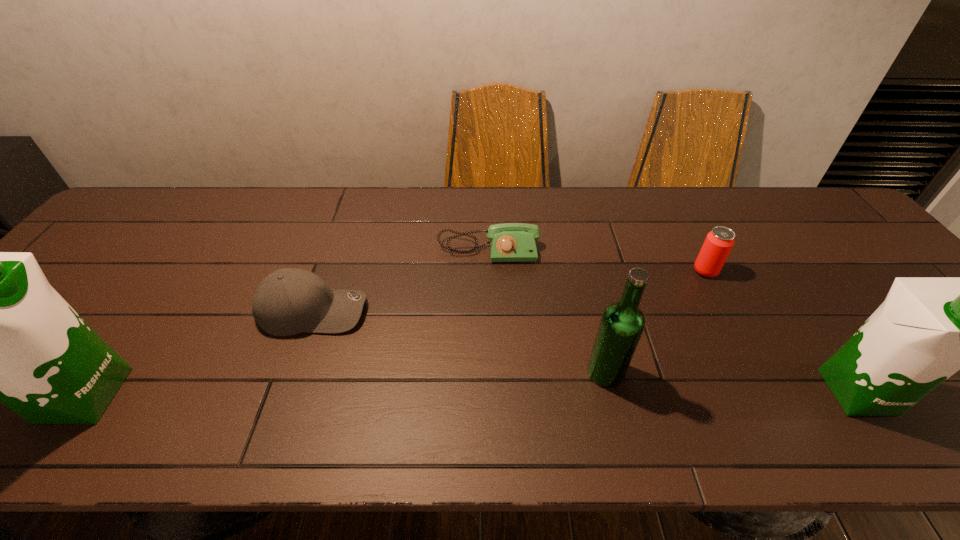
Find the location of `unoccupied area between the taller soya milk and the second object from right to left`. unoccupied area between the taller soya milk and the second object from right to left is located at coordinates (395, 333).

Find the location of `free point between the beer bottle and the right soya milk`. free point between the beer bottle and the right soya milk is located at coordinates (732, 382).

Where is `free space between the telephone and the beer bottle`? free space between the telephone and the beer bottle is located at coordinates (547, 311).

Where is `empty space that is in between the telephone and the fourth nearest object`? empty space that is in between the telephone and the fourth nearest object is located at coordinates (401, 280).

Where is `empty space between the shorter soya milk and the fifth object from left to right`? This screenshot has width=960, height=540. empty space between the shorter soya milk and the fifth object from left to right is located at coordinates (781, 331).

Locate an element on the screen. vacant area between the fifth object from left to right and the beer bottle is located at coordinates (656, 322).

At what (x,y) coordinates should I click in order to perform the action: click on free space between the leftmost object and the rightmost object. Please return your answer as a coordinate pair (x, y). The image size is (960, 540). Looking at the image, I should click on (470, 393).

What are the coordinates of `vacant area between the fourth nearest object and the tallest object` in the screenshot? It's located at (199, 353).

The width and height of the screenshot is (960, 540). I want to click on the third closest object relative to the fifth object from left to right, so click(509, 242).

Choose which object is the second nearest neighbor to the fourth nearest object. Please provide its 2D coordinates. Your answer should be formatted as a tuple, i.e. [(x, y)], where the tuple contains the x and y coordinates of a point satisfying the conditions above.

[(0, 332)]